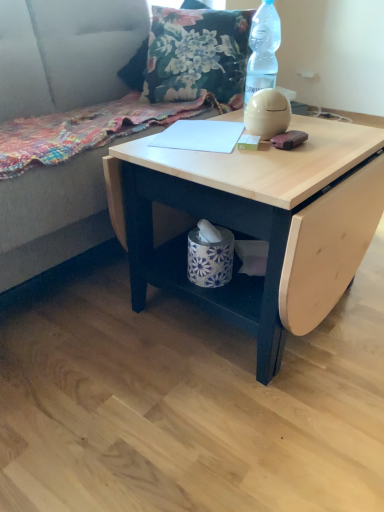
Question: From the image's perspective, is floral fabric pillow at upper center located above or below suede gray couch at upper left?

Choices:
 (A) below
 (B) above

Answer: (B)

Question: From a real-world perspective, relative to suede gray couch at upper left, is floral fabric pillow at upper center vertically above or below?

Choices:
 (A) above
 (B) below

Answer: (A)

Question: Which object is the closest to the suede gray couch at upper left?

Choices:
 (A) floral fabric pillow at upper center
 (B) white paper at center
 (C) transparent plastic bottle at upper right
 (D) light wood table at center

Answer: (A)

Question: Which is farther from the suede gray couch at upper left?

Choices:
 (A) white paper at center
 (B) light wood table at center
 (C) floral fabric pillow at upper center
 (D) transparent plastic bottle at upper right

Answer: (B)